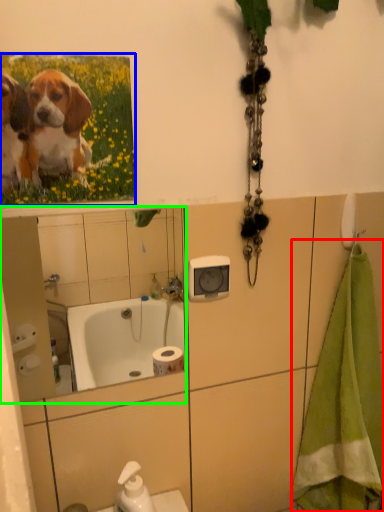
Question: Which object is positioned farthest from bath towel (highlighted by a red box)? Select from flower (highlighted by a blue box) and mirror (highlighted by a green box).

Choices:
 (A) flower
 (B) mirror

Answer: (B)